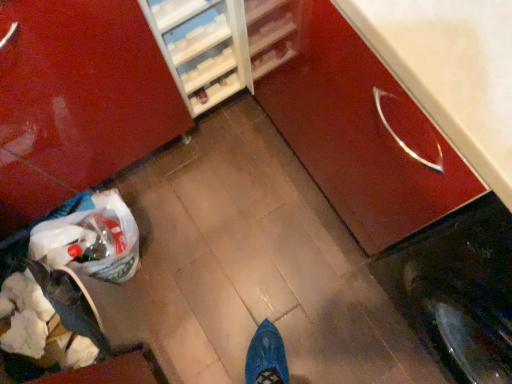
Question: Should I look upward or downward to see glossy wood cabinet at lower right, the 2th cabinetry when ordered from right to left?

Choices:
 (A) up
 (B) down

Answer: (A)

Question: Should I look upward or downward to see glossy wood cabinet at center right, arranged as the first cabinetry when viewed from the right?

Choices:
 (A) down
 (B) up

Answer: (B)

Question: Can you confirm if glossy wood cabinet at lower right, the 2th cabinetry when ordered from right to left, is smaller than white paper bag at lower left?

Choices:
 (A) yes
 (B) no

Answer: (B)

Question: From a real-world perspective, does glossy wood cabinet at lower right, arranged as the first cabinetry when viewed from the left, stand above white paper bag at lower left?

Choices:
 (A) no
 (B) yes

Answer: (B)

Question: Does glossy wood cabinet at lower right, arranged as the first cabinetry when viewed from the left, have a lesser height compared to white paper bag at lower left?

Choices:
 (A) yes
 (B) no

Answer: (B)

Question: Considering the relative sizes of glossy wood cabinet at lower right, the 2th cabinetry when ordered from right to left, and white paper bag at lower left in the image provided, is glossy wood cabinet at lower right, the 2th cabinetry when ordered from right to left, bigger than white paper bag at lower left?

Choices:
 (A) yes
 (B) no

Answer: (A)

Question: Is glossy wood cabinet at lower right, arranged as the first cabinetry when viewed from the left, outside white paper bag at lower left?

Choices:
 (A) no
 (B) yes

Answer: (B)

Question: From the image's perspective, is glossy wood cabinet at lower right, the 2th cabinetry when ordered from right to left, on white paper bag at lower left?

Choices:
 (A) no
 (B) yes

Answer: (B)

Question: Considering the relative sizes of white paper bag at lower left and glossy wood cabinet at lower right, arranged as the first cabinetry when viewed from the left, in the image provided, is white paper bag at lower left wider than glossy wood cabinet at lower right, arranged as the first cabinetry when viewed from the left,?

Choices:
 (A) no
 (B) yes

Answer: (A)

Question: Can you confirm if white paper bag at lower left is taller than glossy wood cabinet at lower right, arranged as the first cabinetry when viewed from the left?

Choices:
 (A) no
 (B) yes

Answer: (A)

Question: Is white paper bag at lower left facing away from glossy wood cabinet at lower right, the 2th cabinetry when ordered from right to left?

Choices:
 (A) yes
 (B) no

Answer: (B)

Question: Is white paper bag at lower left at the left side of glossy wood cabinet at lower right, the 2th cabinetry when ordered from right to left?

Choices:
 (A) no
 (B) yes

Answer: (B)

Question: Is white paper bag at lower left closer to the viewer compared to glossy wood cabinet at lower right, arranged as the first cabinetry when viewed from the left?

Choices:
 (A) no
 (B) yes

Answer: (A)

Question: From the image's perspective, is white paper bag at lower left under glossy wood cabinet at lower right, arranged as the first cabinetry when viewed from the left?

Choices:
 (A) yes
 (B) no

Answer: (A)

Question: Is glossy wood cabinet at center right, arranged as the first cabinetry when viewed from the right, touching white paper bag at lower left?

Choices:
 (A) yes
 (B) no

Answer: (B)